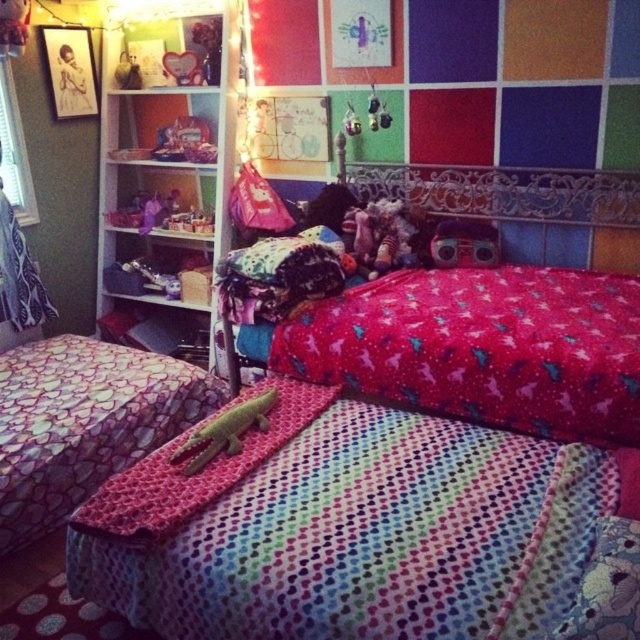
Which is behind, point (140, 524) or point (484, 237)?

Positioned behind is point (484, 237).

Does point (458, 576) come in front of point (499, 244)?

That is True.

At what (x,y) coordinates should I click in order to perform the action: click on multicolored knitted blanket at center. Please return your answer as a coordinate pair (x, y). This screenshot has height=640, width=640. Looking at the image, I should click on (348, 529).

Which is behind, point (253, 422) or point (467, 227)?

Point (467, 227)

Identify the location of green fabric crocodile at center. This screenshot has height=640, width=640. pyautogui.click(x=225, y=432).

Does point (428, 188) come farther from viewer compared to point (456, 237)?

Yes, point (428, 188) is farther from viewer.

Does red fabric bed at center appear on the right side of matte plastic toy at center?

In fact, red fabric bed at center is to the left of matte plastic toy at center.

Locate an element on the screen. red fabric bed at center is located at coordinates (483, 348).

Find the location of `red fabric bed at center`. red fabric bed at center is located at coordinates (483, 348).